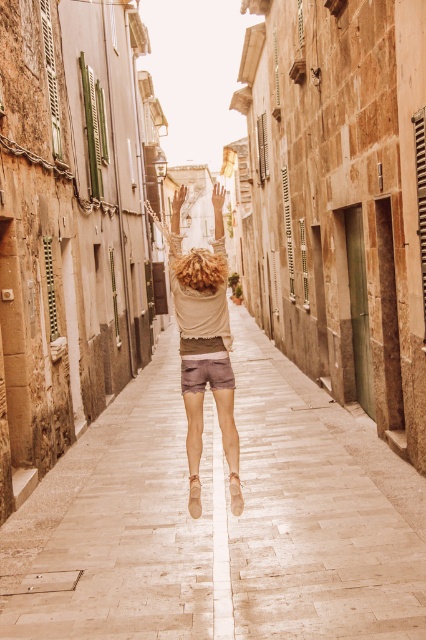
Does smooth stone pavement at center have a larger size compared to beige cotton shorts at center?

Correct, smooth stone pavement at center is larger in size than beige cotton shorts at center.

Who is lower down, smooth stone pavement at center or beige cotton shorts at center?

Positioned lower is smooth stone pavement at center.

In the scene shown: Measure the distance between point (x=143, y=579) and camera.

Point (x=143, y=579) and camera are 5.23 meters apart from each other.

Image resolution: width=426 pixels, height=640 pixels. In order to click on smooth stone pavement at center in this screenshot , I will do `click(221, 518)`.